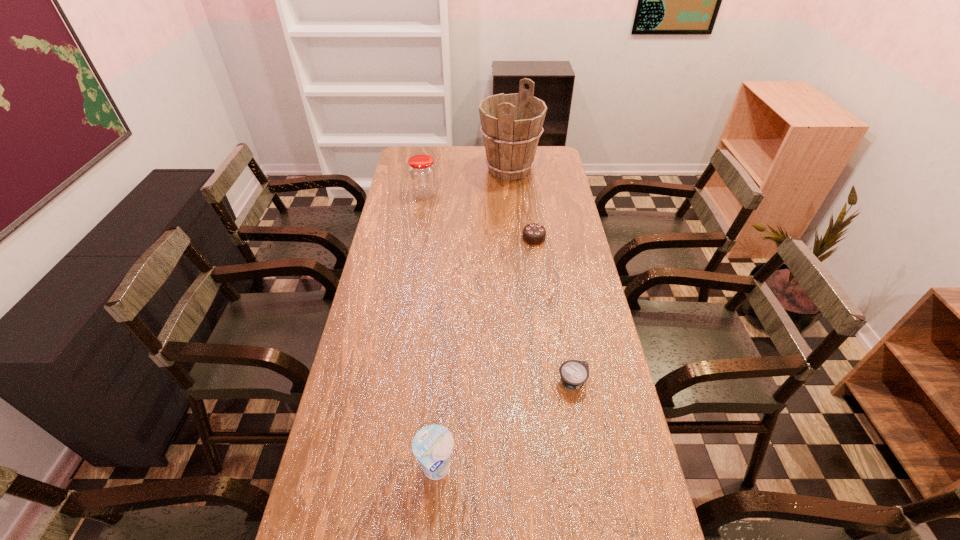
This screenshot has width=960, height=540. In order to click on vacant point located between the nearest object and the third nearest object in this screenshot , I will do `click(485, 354)`.

You are a GUI agent. You are given a task and a screenshot of the screen. Output one action in this format:
    pyautogui.click(x=<x>, y=<y>)
    Task: Click on the vacant area that lies between the nearer yogurt and the chocolate cake
    The image size is (960, 540).
    Given the screenshot: What is the action you would take?
    [485, 354]

At what (x,y) coordinates should I click in order to perform the action: click on empty space between the nearer yogurt and the second tallest object. Please return your answer as a coordinate pair (x, y). Looking at the image, I should click on (430, 332).

Identify which object is located as the second nearest to the left yogurt. Please provide its 2D coordinates. Your answer should be formatted as a tuple, i.e. [(x, y)], where the tuple contains the x and y coordinates of a point satisfying the conditions above.

[(534, 234)]

Select which object is the fourth closest to the fourth farthest object. Please provide its 2D coordinates. Your answer should be formatted as a tuple, i.e. [(x, y)], where the tuple contains the x and y coordinates of a point satisfying the conditions above.

[(511, 124)]

Where is `free space that satisfies the following two spatial constraints: 1. on the back side of the nearer yogurt; 2. on the right side of the right yogurt`? Image resolution: width=960 pixels, height=540 pixels. free space that satisfies the following two spatial constraints: 1. on the back side of the nearer yogurt; 2. on the right side of the right yogurt is located at coordinates (443, 382).

Identify the location of free spot that satisfies the following two spatial constraints: 1. on the front side of the jar; 2. on the right side of the fourth tallest object. (417, 238).

The width and height of the screenshot is (960, 540). In order to click on free space that satisfies the following two spatial constraints: 1. on the front side of the tallest object; 2. on the left side of the shorter yogurt in this screenshot , I will do `click(529, 382)`.